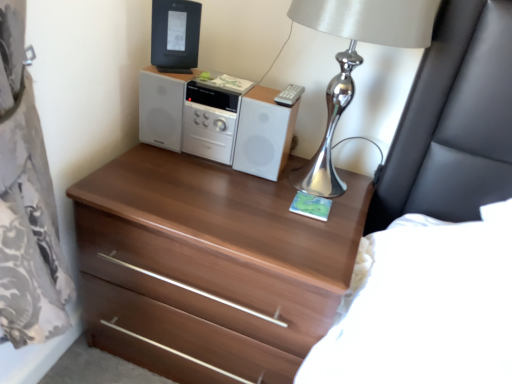
At what (x,y) coordinates should I click in order to perform the action: click on vacant area that is in front of white glossy stereo at center. Please return your answer as a coordinate pair (x, y). The image size is (512, 384). Looking at the image, I should click on (199, 202).